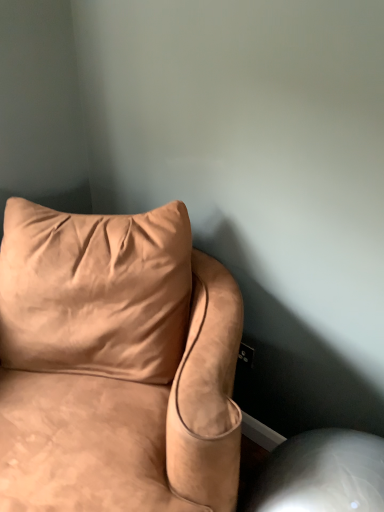
Measure the distance between point (163, 471) and camera.

The depth of point (163, 471) is 38.74 inches.

What is the approximate height of suede-like tan couch at upper left?

suede-like tan couch at upper left is 34.98 inches in height.

The image size is (384, 512). Describe the element at coordinates (115, 364) in the screenshot. I see `suede-like tan couch at upper left` at that location.

What is the approximate width of suede-like tan couch at upper left?

suede-like tan couch at upper left is 35.29 inches wide.

Where is `suede-like tan couch at upper left`? The image size is (384, 512). suede-like tan couch at upper left is located at coordinates (115, 364).

Locate an element on the screen. suede-like tan couch at upper left is located at coordinates (115, 364).